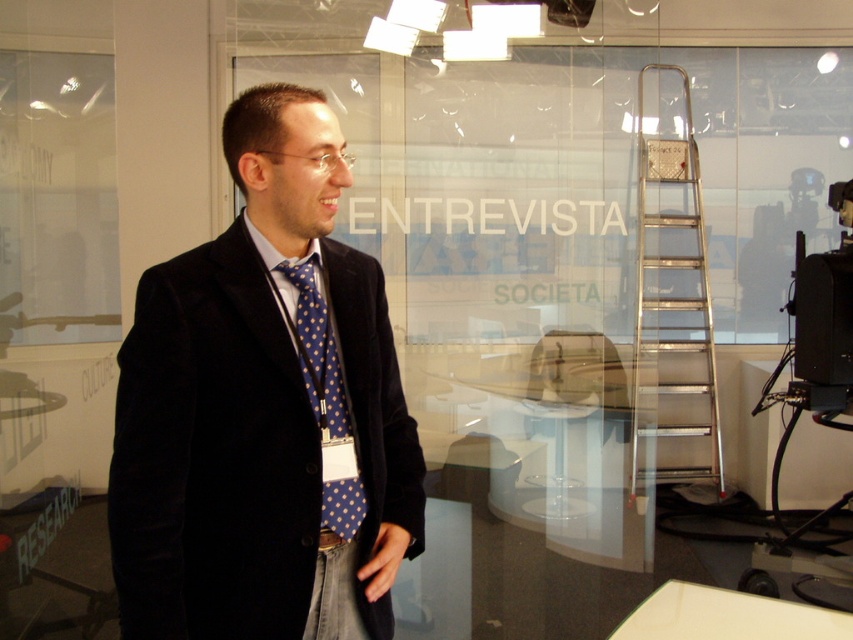
Question: Which of the following is the farthest from the observer?

Choices:
 (A) black plastic video camera at right
 (B) blue dotted fabric tie at center

Answer: (A)

Question: Can you confirm if silver metallic ladder at right is thinner than black plastic video camera at right?

Choices:
 (A) yes
 (B) no

Answer: (B)

Question: Which object appears closest to the camera in this image?

Choices:
 (A) black plastic video camera at right
 (B) velvet black suit at center
 (C) silver metallic ladder at right
 (D) blue dotted fabric tie at center

Answer: (B)

Question: Which of the following is the closest to the observer?

Choices:
 (A) (840, 355)
 (B) (340, 416)
 (C) (636, 296)
 (D) (334, 397)

Answer: (D)

Question: Is black plastic video camera at right wider than blue dotted fabric tie at center?

Choices:
 (A) yes
 (B) no

Answer: (A)

Question: Does velvet black suit at center have a greater width compared to silver metallic ladder at right?

Choices:
 (A) yes
 (B) no

Answer: (A)